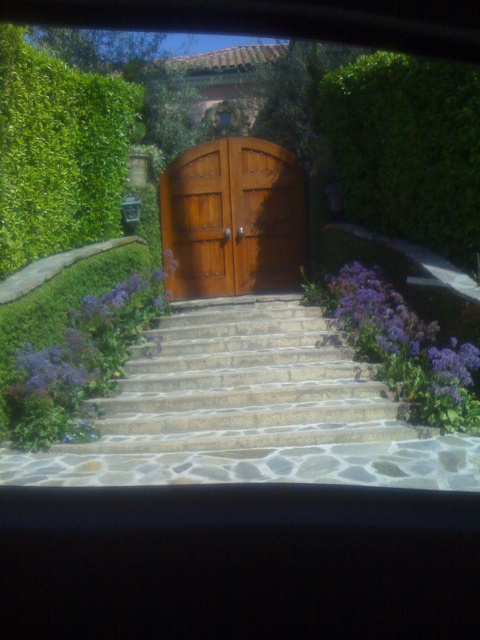
Does point (259, 339) come behind point (107, 140)?

That is False.

Does pebble stone stairs at center have a larger size compared to green leafy hedge at upper left?

Yes.

At what (x,y) coordinates should I click in order to perform the action: click on pebble stone stairs at center. Please return your answer as a coordinate pair (x, y). The width and height of the screenshot is (480, 640). Looking at the image, I should click on (243, 384).

Who is higher up, pebble stone stairs at center or purple matte flower at center?

purple matte flower at center is higher up.

Who is lower down, pebble stone stairs at center or purple matte flower at center?

Positioned lower is pebble stone stairs at center.

Image resolution: width=480 pixels, height=640 pixels. Describe the element at coordinates (243, 384) in the screenshot. I see `pebble stone stairs at center` at that location.

At what (x,y) coordinates should I click in order to perform the action: click on pebble stone stairs at center. Please return your answer as a coordinate pair (x, y). This screenshot has height=640, width=480. Looking at the image, I should click on (243, 384).

Based on the photo, can you confirm if green leafy hedge at upper center is positioned below purple matte flower at center?

No.

What do you see at coordinates (406, 148) in the screenshot?
I see `green leafy hedge at upper center` at bounding box center [406, 148].

This screenshot has width=480, height=640. In order to click on green leafy hedge at upper center in this screenshot , I will do `click(406, 148)`.